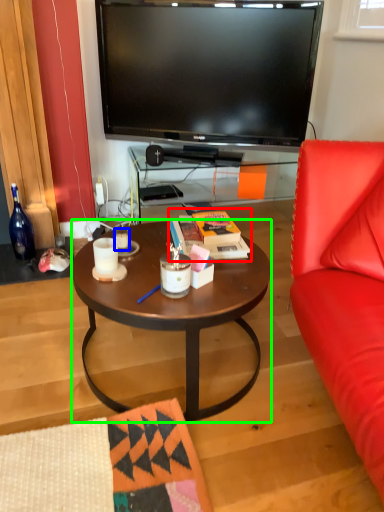
Question: Considering the real-world distances, which object is farthest from magazine (highlighted by a red box)? coffee cup (highlighted by a blue box) or coffee table (highlighted by a green box)?

Choices:
 (A) coffee cup
 (B) coffee table

Answer: (A)